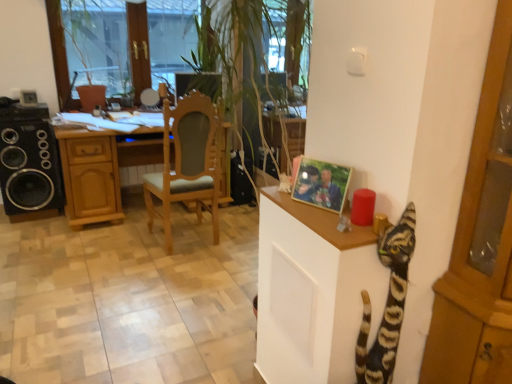
Question: Looking at their shapes, would you say wooden desk at center is wider or thinner than light brown wood chair at center?

Choices:
 (A) wide
 (B) thin

Answer: (A)

Question: From the image's perspective, relative to light brown wood chair at center, is wooden desk at center above or below?

Choices:
 (A) above
 (B) below

Answer: (A)

Question: Which of these objects is positioned closest to the light brown wood chair at center?

Choices:
 (A) wooden desk at center
 (B) transparent glass window at upper center
 (C) wooden photo frame at upper right
 (D) striped fur cat at right
 (E) wooden cabinet at right

Answer: (A)

Question: Considering the real-world distances, which object is farthest from the wooden cabinet at right?

Choices:
 (A) striped fur cat at right
 (B) transparent glass window at upper center
 (C) transparent glass window screen at upper left
 (D) light brown wood chair at center
 (E) black matte speaker at left

Answer: (B)